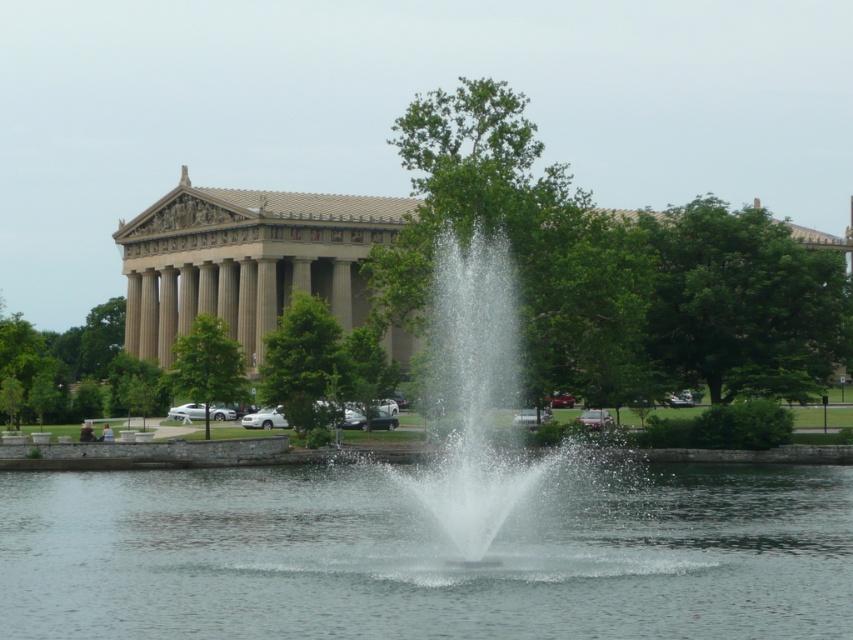
Describe the element at coordinates (428, 552) in the screenshot. I see `clear water at center` at that location.

Is point (489, 620) less distant than point (480, 291)?

Yes, point (489, 620) is closer to viewer.

This screenshot has height=640, width=853. Identify the location of clear water at center. (428, 552).